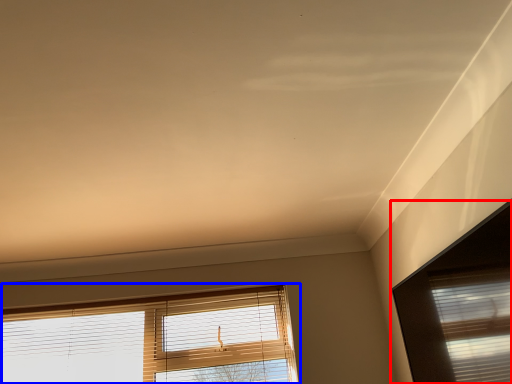
Question: Which object is further to the camera taking this photo, window (highlighted by a red box) or window (highlighted by a blue box)?

Choices:
 (A) window
 (B) window

Answer: (B)